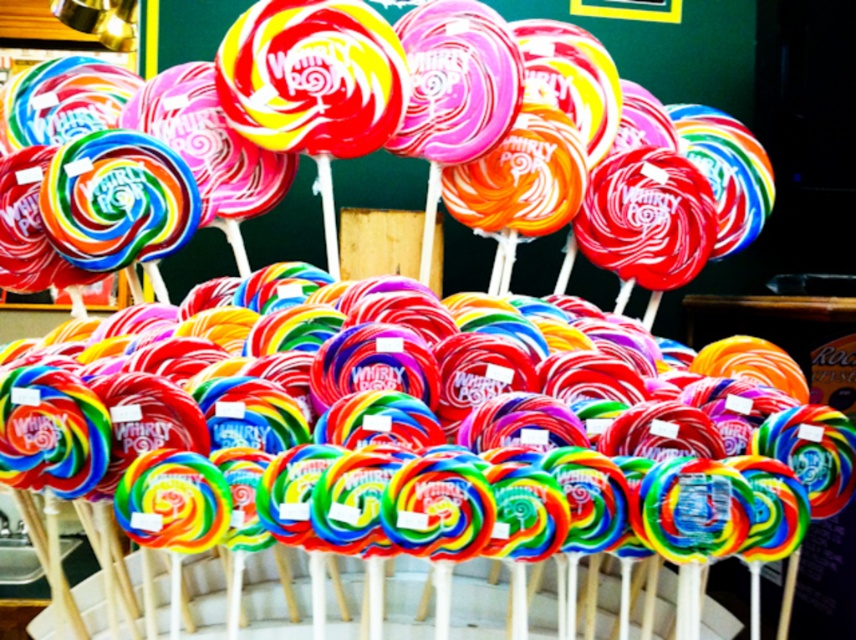
Does rainbow swirl lollipop at center have a larger size compared to swirled candy at center?

Indeed, rainbow swirl lollipop at center has a larger size compared to swirled candy at center.

Does rainbow swirl lollipop at center appear over swirled candy at center?

Incorrect, rainbow swirl lollipop at center is not positioned above swirled candy at center.

Which is in front, point (797, 524) or point (336, 170)?

Point (797, 524) is more forward.

Where is `rainbow swirl lollipop at center`? This screenshot has width=856, height=640. rainbow swirl lollipop at center is located at coordinates (421, 451).